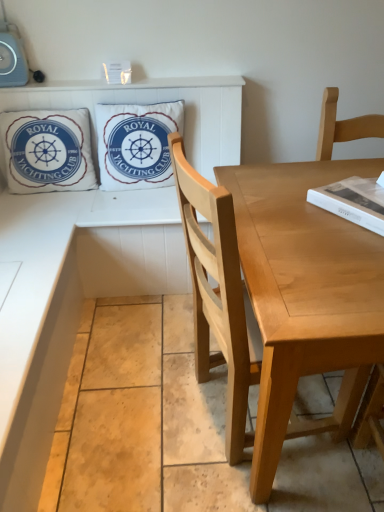
Question: Which direction should I rotate to look at white cotton pillow at upper center, placed as the 2th pillow when sorted from left to right, — up or down?

Choices:
 (A) down
 (B) up

Answer: (B)

Question: Is white cotton pillow at upper center, placed as the 2th pillow when sorted from left to right, oriented towards white cotton pillow at upper left, which is the second pillow in right-to-left order?

Choices:
 (A) no
 (B) yes

Answer: (A)

Question: Does white cotton pillow at upper center, which is the first pillow in right-to-left order, have a greater height compared to white cotton pillow at upper left, which is the second pillow in right-to-left order?

Choices:
 (A) yes
 (B) no

Answer: (B)

Question: Is white cotton pillow at upper center, placed as the 2th pillow when sorted from left to right, to the right of white cotton pillow at upper left, which is the second pillow in right-to-left order, from the viewer's perspective?

Choices:
 (A) no
 (B) yes

Answer: (B)

Question: From a real-world perspective, is white cotton pillow at upper center, which is the first pillow in right-to-left order, beneath white cotton pillow at upper left, the first pillow from the left?

Choices:
 (A) no
 (B) yes

Answer: (A)

Question: From the image's perspective, is white cotton pillow at upper center, placed as the 2th pillow when sorted from left to right, under white cotton pillow at upper left, the first pillow from the left?

Choices:
 (A) no
 (B) yes

Answer: (A)

Question: Can we say white cotton pillow at upper center, which is the first pillow in right-to-left order, lies outside white cotton pillow at upper left, the first pillow from the left?

Choices:
 (A) yes
 (B) no

Answer: (A)

Question: Is white cotton pillow at upper center, placed as the 2th pillow when sorted from left to right, thinner than light brown wood chair at right?

Choices:
 (A) yes
 (B) no

Answer: (A)

Question: From the image's perspective, would you say white cotton pillow at upper center, placed as the 2th pillow when sorted from left to right, is shown under light brown wood chair at right?

Choices:
 (A) no
 (B) yes

Answer: (A)

Question: From a real-world perspective, is white cotton pillow at upper center, placed as the 2th pillow when sorted from left to right, located beneath light brown wood chair at right?

Choices:
 (A) no
 (B) yes

Answer: (A)

Question: Would you say light brown wood chair at right is part of white cotton pillow at upper center, placed as the 2th pillow when sorted from left to right,'s contents?

Choices:
 (A) yes
 (B) no

Answer: (B)

Question: From the image's perspective, is white cotton pillow at upper center, which is the first pillow in right-to-left order, on top of light brown wood chair at right?

Choices:
 (A) no
 (B) yes

Answer: (B)

Question: From a real-world perspective, is white cotton pillow at upper center, placed as the 2th pillow when sorted from left to right, on top of light brown wood chair at right?

Choices:
 (A) yes
 (B) no

Answer: (A)

Question: Considering the relative sizes of white cotton pillow at upper left, which is the second pillow in right-to-left order, and white matte book at upper right in the image provided, is white cotton pillow at upper left, which is the second pillow in right-to-left order, smaller than white matte book at upper right?

Choices:
 (A) yes
 (B) no

Answer: (B)